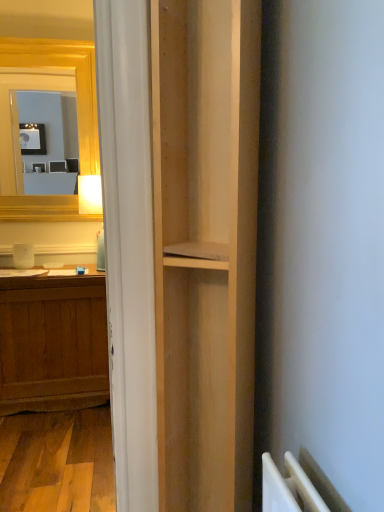
Question: In the image, is wooden desk at left on the left side or the right side of natural wood bookshelf at center?

Choices:
 (A) right
 (B) left

Answer: (B)

Question: From the image's perspective, is wooden desk at left located above or below natural wood bookshelf at center?

Choices:
 (A) above
 (B) below

Answer: (B)

Question: In terms of height, does wooden desk at left look taller or shorter compared to natural wood bookshelf at center?

Choices:
 (A) short
 (B) tall

Answer: (B)

Question: Looking at the image, does natural wood bookshelf at center seem bigger or smaller compared to wooden desk at left?

Choices:
 (A) small
 (B) big

Answer: (B)

Question: In terms of height, does natural wood bookshelf at center look taller or shorter compared to wooden desk at left?

Choices:
 (A) tall
 (B) short

Answer: (B)

Question: From a real-world perspective, is natural wood bookshelf at center physically located above or below wooden desk at left?

Choices:
 (A) below
 (B) above

Answer: (B)

Question: In the image, is natural wood bookshelf at center positioned in front of or behind wooden desk at left?

Choices:
 (A) behind
 (B) front

Answer: (B)